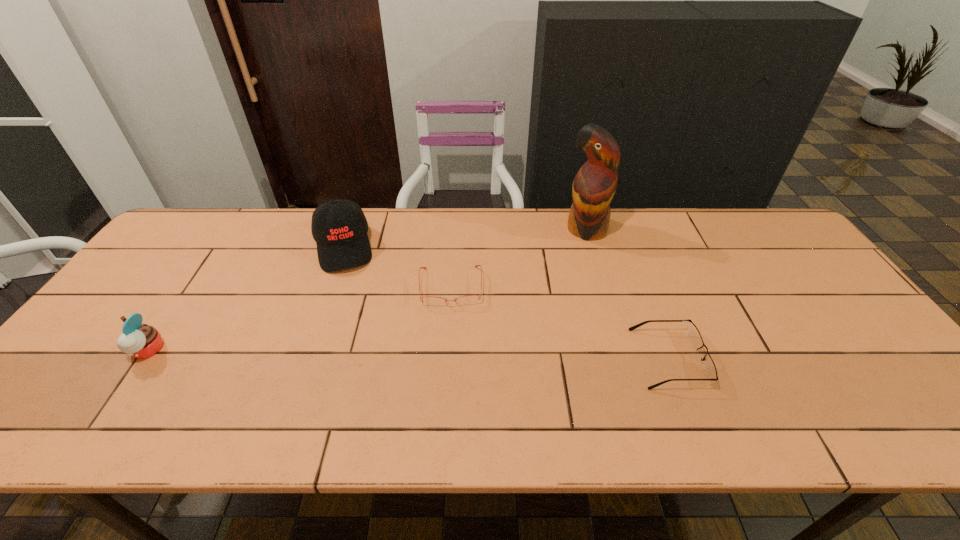
Find the location of a particular element. This screenshot has height=540, width=960. free spot on the desktop that is between the leftmost object and the right spectacles and is positioned on the front-facing side of the baseball cap is located at coordinates (363, 354).

Where is `vacant spot on the desktop that is between the leftmost object and the nearer spectacles and is positioned on the face of the tallest object`? This screenshot has height=540, width=960. vacant spot on the desktop that is between the leftmost object and the nearer spectacles and is positioned on the face of the tallest object is located at coordinates (469, 356).

Where is `vacant space on the desktop that is between the muffin and the right spectacles and is positioned on the lenses of the farther spectacles`? Image resolution: width=960 pixels, height=540 pixels. vacant space on the desktop that is between the muffin and the right spectacles and is positioned on the lenses of the farther spectacles is located at coordinates (451, 355).